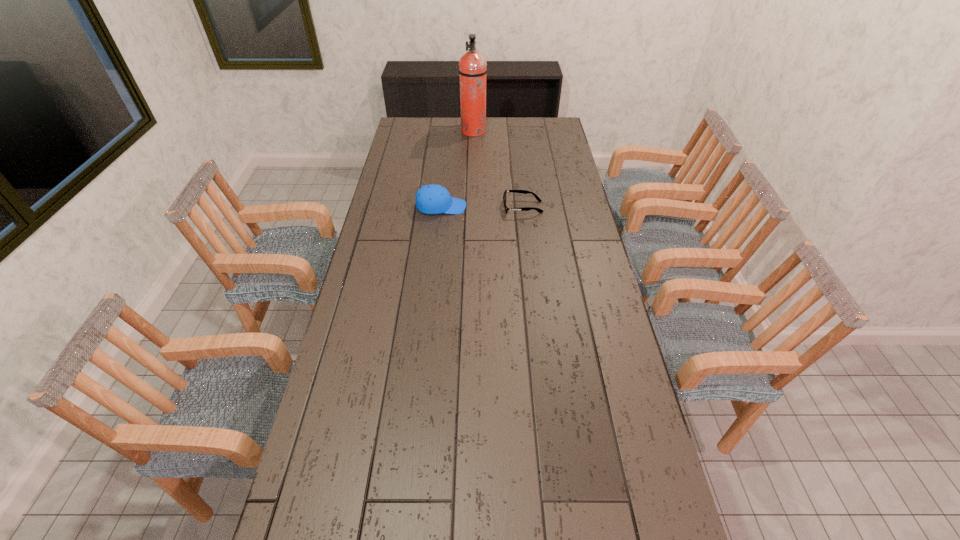
Locate an element on the screen. object present at the far edge is located at coordinates (472, 65).

Image resolution: width=960 pixels, height=540 pixels. What are the coordinates of `vacant region at the far edge` in the screenshot? It's located at (514, 127).

Identify the location of vacant space at the left edge. (420, 150).

Where is `vacant space at the right edge of the desktop`? The height and width of the screenshot is (540, 960). vacant space at the right edge of the desktop is located at coordinates (658, 535).

You are a GUI agent. You are given a task and a screenshot of the screen. Output one action in this format:
    pyautogui.click(x=<x>, y=<y>)
    Task: Click on the free space at the far right corner of the desktop
    This screenshot has width=960, height=540.
    Given the screenshot: What is the action you would take?
    pyautogui.click(x=558, y=127)

Where is `vacant space that's between the cap and the rightmost object`? The height and width of the screenshot is (540, 960). vacant space that's between the cap and the rightmost object is located at coordinates (482, 207).

Find the location of a particular element. empty space between the cap and the fire extinguisher is located at coordinates (x=457, y=169).

The image size is (960, 540). What are the coordinates of `blank region between the second shortest object and the sunglasses` in the screenshot? It's located at (482, 207).

Where is `empty location between the sunglasses and the fire extinguisher`? The height and width of the screenshot is (540, 960). empty location between the sunglasses and the fire extinguisher is located at coordinates (498, 170).

Choose which object is the second nearest neighbor to the fire extinguisher. Please provide its 2D coordinates. Your answer should be formatted as a tuple, i.e. [(x, y)], where the tuple contains the x and y coordinates of a point satisfying the conditions above.

[(515, 191)]